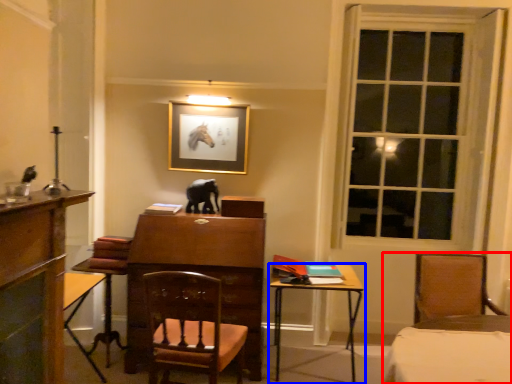
Question: Which object is further to the camera taking this photo, chair (highlighted by a red box) or table (highlighted by a blue box)?

Choices:
 (A) chair
 (B) table

Answer: (B)